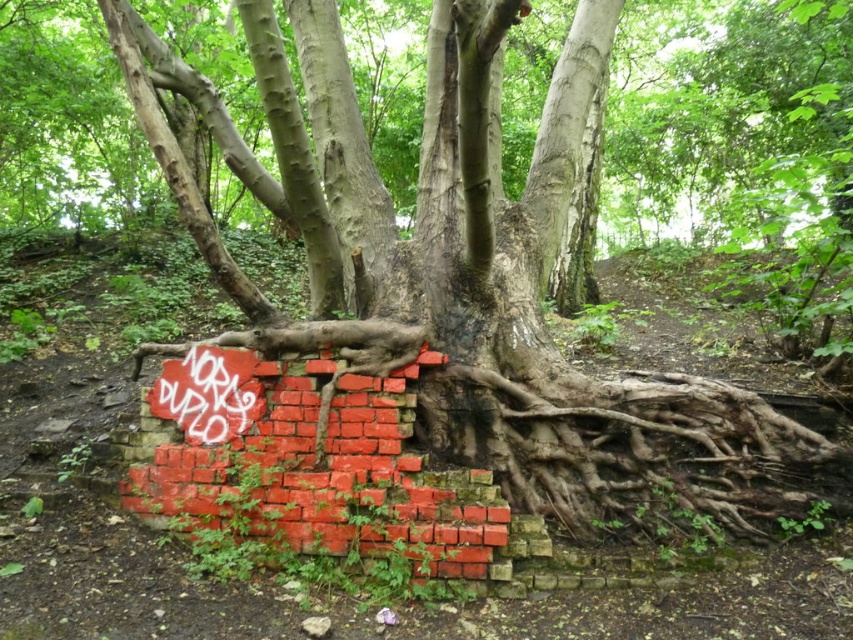
Question: Does red brick wall at center lie behind grungy graffiti at center?

Choices:
 (A) yes
 (B) no

Answer: (B)

Question: Does red brick wall at center appear under grungy graffiti at center?

Choices:
 (A) yes
 (B) no

Answer: (A)

Question: Which point is closer to the camera taking this photo?

Choices:
 (A) (177, 515)
 (B) (190, 442)

Answer: (A)

Question: Which point is closer to the camera?

Choices:
 (A) (242, 396)
 (B) (241, 460)

Answer: (B)

Question: Is red brick wall at center behind grungy graffiti at center?

Choices:
 (A) no
 (B) yes

Answer: (A)

Question: Which point is farther to the camera?

Choices:
 (A) (213, 400)
 (B) (354, 426)

Answer: (A)